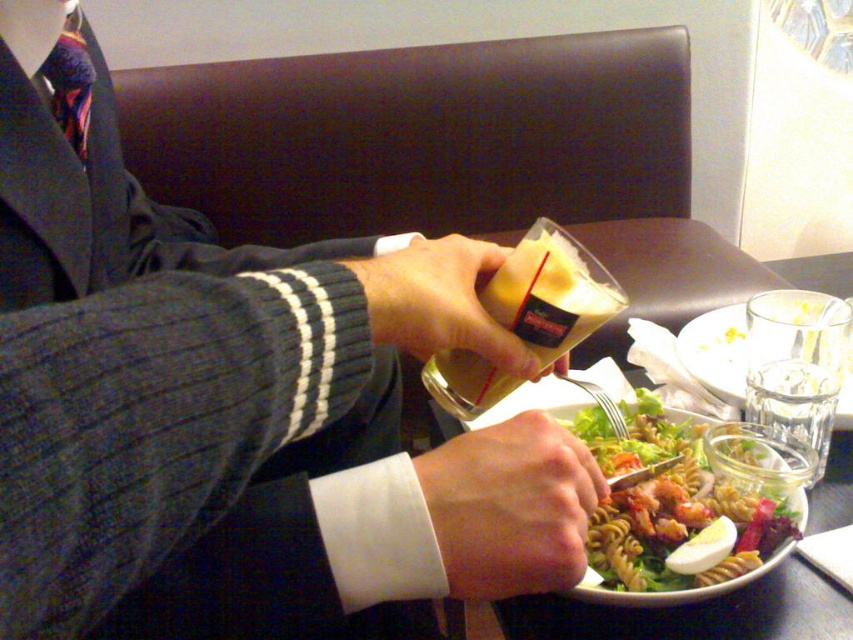
You are a waiter and you need to refill the matte plastic cup at center without touching the white matte hand at lower center. Is it possible to do so based on their positions?

The matte plastic cup at center is behind the white matte hand at lower center, so you can reach around the back of the white matte hand at lower center to refill the matte plastic cup at center without touching it.

You are the person sitting at the table. You want to reach for either the point at [573,460] or the point at [648,612]. Which point is closer to you?

Point at [573,460] is in front of point at [648,612], so it is closer to you.

Looking at this image, you are a photographer trying to capture the white matte hand at lower center in the image. Where should you focus your camera to ensure it is in sharp focus?

You should focus your camera at point 0.792 on the x axis and 0.599 on the y axis to ensure the white matte hand at lower center is in sharp focus.